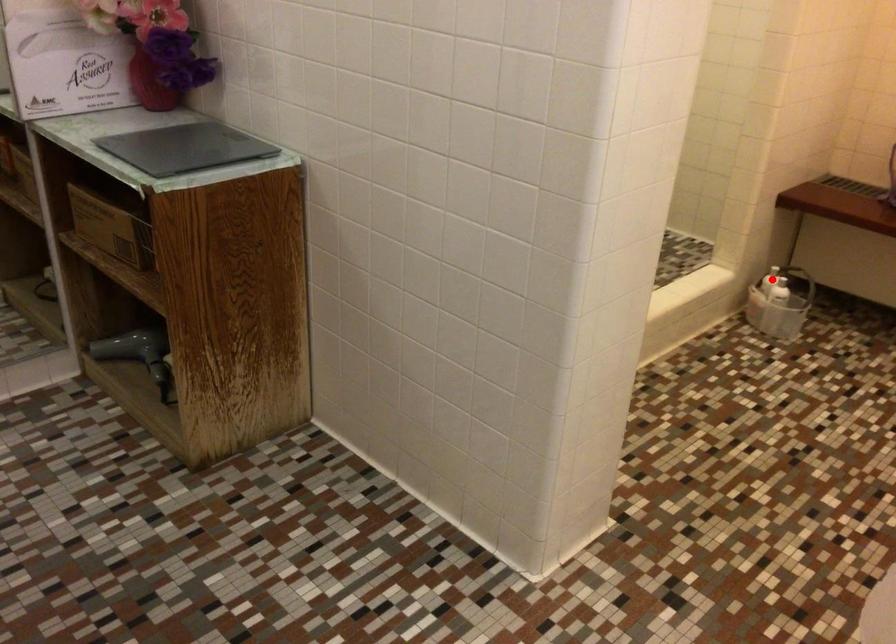
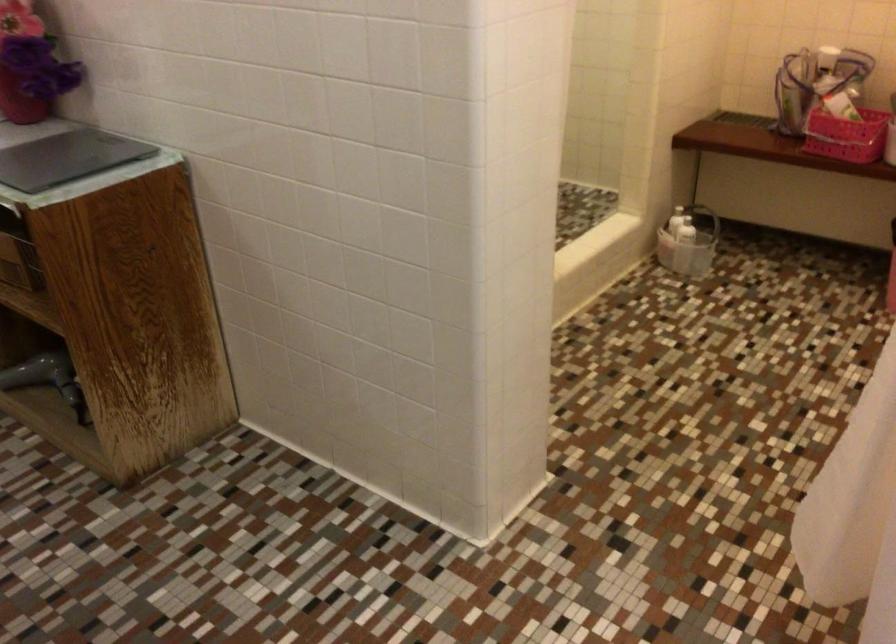
Locate, in the second image, the point that corresponds to the highlighted location in the first image.

(678, 220)